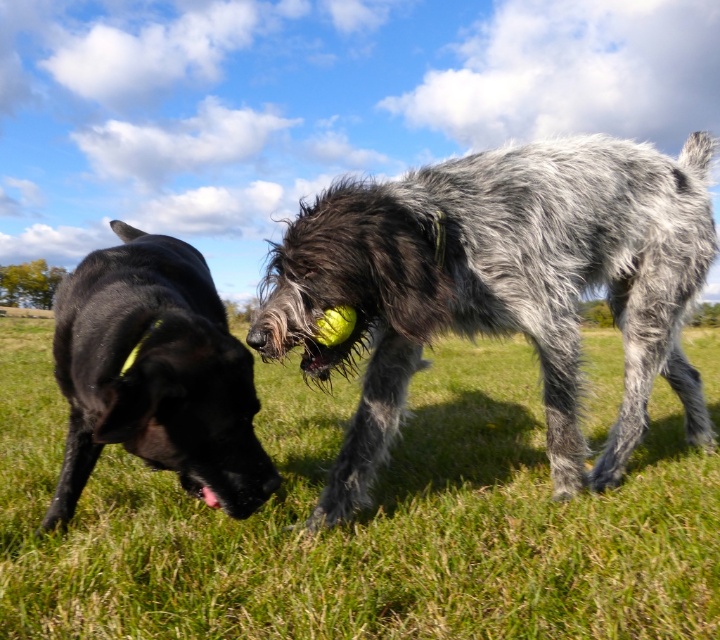
Can you confirm if gray shaggy dog at center is positioned above shiny black dog at left?

Yes.

Does gray shaggy dog at center have a larger size compared to shiny black dog at left?

Yes.

Describe the element at coordinates (499, 285) in the screenshot. I see `gray shaggy dog at center` at that location.

This screenshot has height=640, width=720. In order to click on gray shaggy dog at center in this screenshot , I will do pyautogui.click(x=499, y=285).

Who is more distant from viewer, (639, 452) or (356, 256)?

Point (639, 452)

You are a GUI agent. You are given a task and a screenshot of the screen. Output one action in this format:
    pyautogui.click(x=<x>, y=<y>)
    Task: Click on the green grassy at center
    
    Given the screenshot: What is the action you would take?
    pyautogui.click(x=361, y=522)

Locate an element on the screen. The image size is (720, 640). green grassy at center is located at coordinates (361, 522).

Measure the distance from green grassy at center to shiny black dog at left.

green grassy at center is 5.58 feet from shiny black dog at left.

Between point (14, 449) and point (186, 467), which one is positioned behind?

The point (14, 449) is more distant.

Image resolution: width=720 pixels, height=640 pixels. Find the location of `green grassy at center`. green grassy at center is located at coordinates (361, 522).